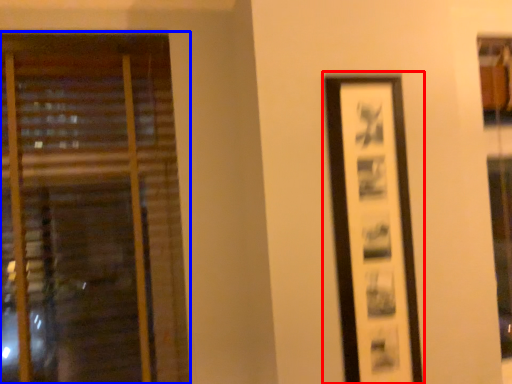
Question: Which of the following is the closest to the observer, picture frame (highlighted by a red box) or window (highlighted by a blue box)?

Choices:
 (A) picture frame
 (B) window

Answer: (A)